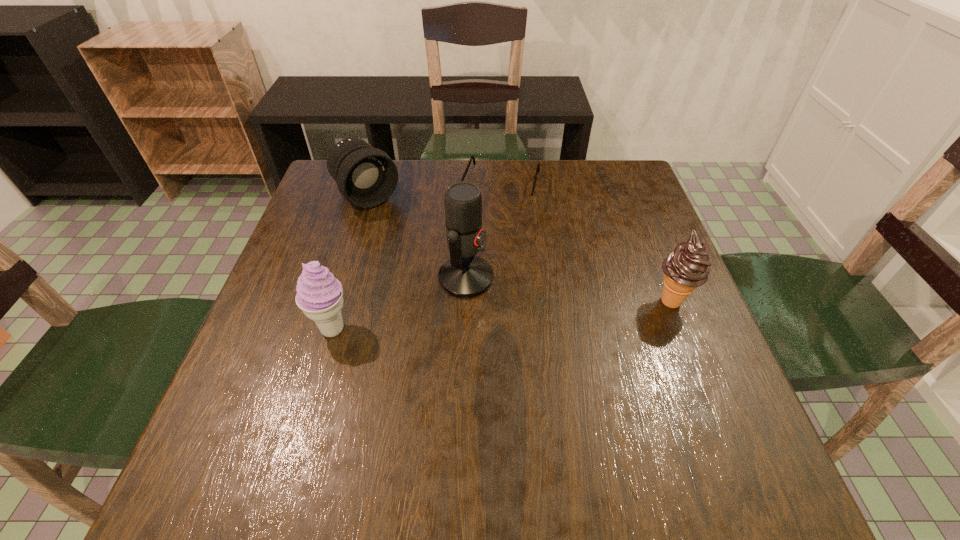
I want to click on vacant position located 0.220m on the side of the tallest object with the red ring, so click(587, 322).

You are a GUI agent. You are given a task and a screenshot of the screen. Output one action in this format:
    pyautogui.click(x=<x>, y=<y>)
    Task: Click on the vacant space situated on the side of the tallest object with the red ring
    
    Given the screenshot: What is the action you would take?
    pyautogui.click(x=656, y=348)

Locate an element on the screen. vacant space located 0.310m on the side of the tallest object with the red ring is located at coordinates (631, 339).

Identify the location of vacant space located 0.300m at the hinge ends of the spectacles. (467, 298).

At what (x,y) coordinates should I click in order to perform the action: click on vacant area situated at the hinge ends of the spectacles. Please return your answer as a coordinate pair (x, y). The image size is (960, 540). Looking at the image, I should click on (469, 291).

Where is `free space located 0.180m at the hinge ends of the spectacles`? free space located 0.180m at the hinge ends of the spectacles is located at coordinates (479, 260).

Find the location of a particular element. The height and width of the screenshot is (540, 960). telephoto lens situated at the far edge is located at coordinates (366, 177).

You are a GUI agent. You are given a task and a screenshot of the screen. Output one action in this format:
    pyautogui.click(x=<x>, y=<y>)
    Task: Click on the spectacles that is positioned at the far edge
    This screenshot has height=540, width=960.
    Given the screenshot: What is the action you would take?
    pyautogui.click(x=512, y=200)

I want to click on icecream that is at the left edge, so click(x=319, y=295).

You are a GUI agent. You are given a task and a screenshot of the screen. Output one action in this format:
    pyautogui.click(x=<x>, y=<y>)
    Task: Click on the telephoto lens present at the left edge
    
    Given the screenshot: What is the action you would take?
    pyautogui.click(x=366, y=177)